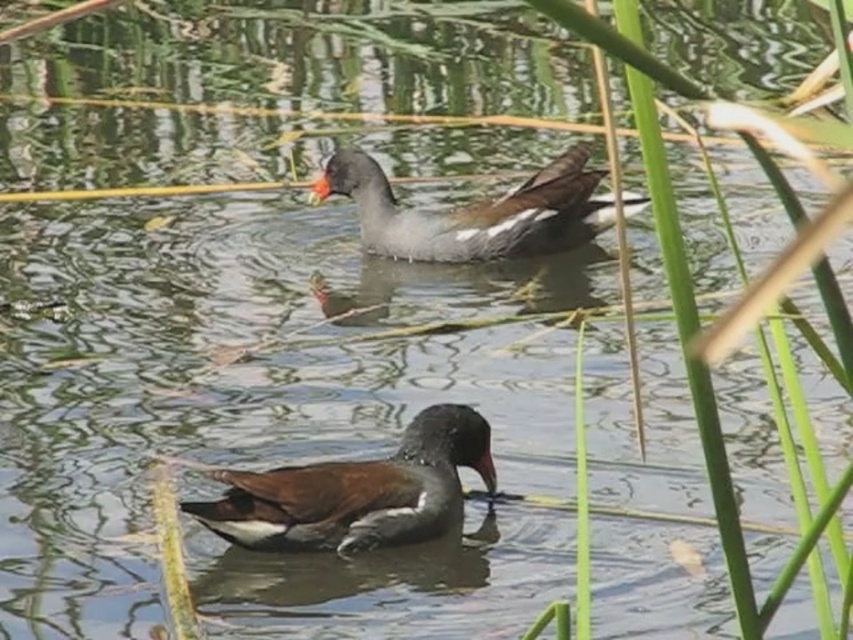
You are a birdwatcher observing two ducks in the water. You notice the dark gray matte duck at center and the gray matte duck at upper center. Which duck is closer to the surface of the water?

The dark gray matte duck at center is shorter than the gray matte duck at upper center, so the dark gray matte duck at center is closer to the surface of the water.

Consider the image. You are standing at the edge of the water and see the dark gray matte duck at center. If you want to throw a small pebble to hit the duck, where should you aim? Please provide the coordinates in the format of x,y between 0 and 1.

You should aim at point (357, 492) to hit the dark gray matte duck at center.